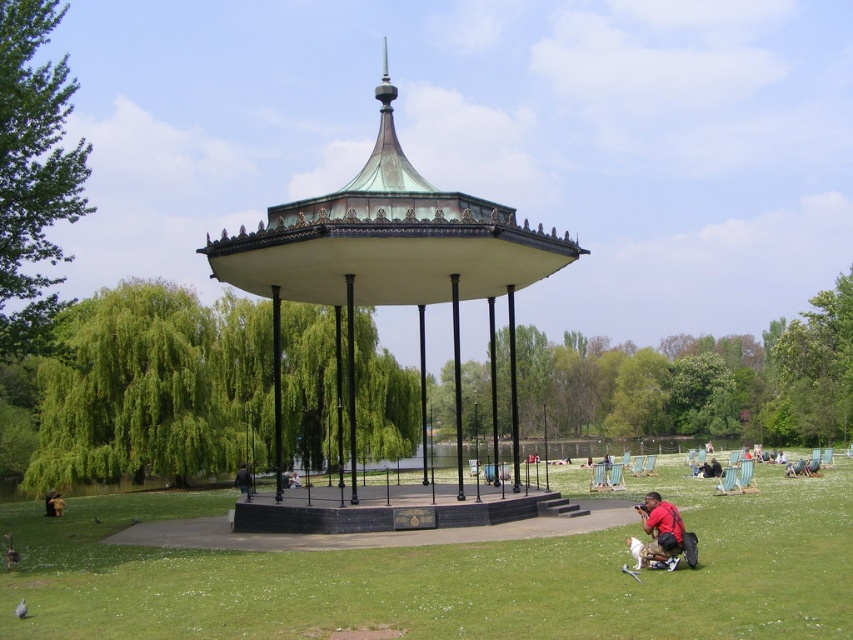
You are standing at point (445,577) in the image. Based on the scene description, what do you see directly beneath your feet?

The point (445,577) is located at the green grassy at center, so you would see green grass beneath your feet.